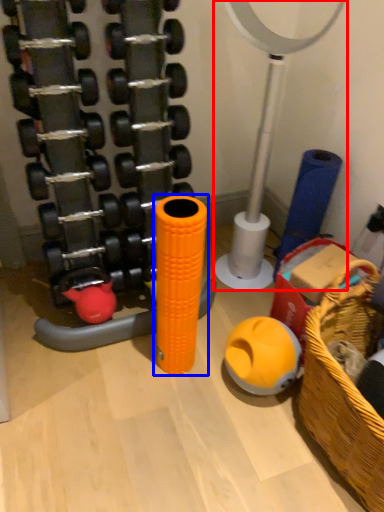
Question: Which object appears farthest to the camera in this image, basketball hoop (highlighted by a red box) or toy (highlighted by a blue box)?

Choices:
 (A) basketball hoop
 (B) toy

Answer: (B)